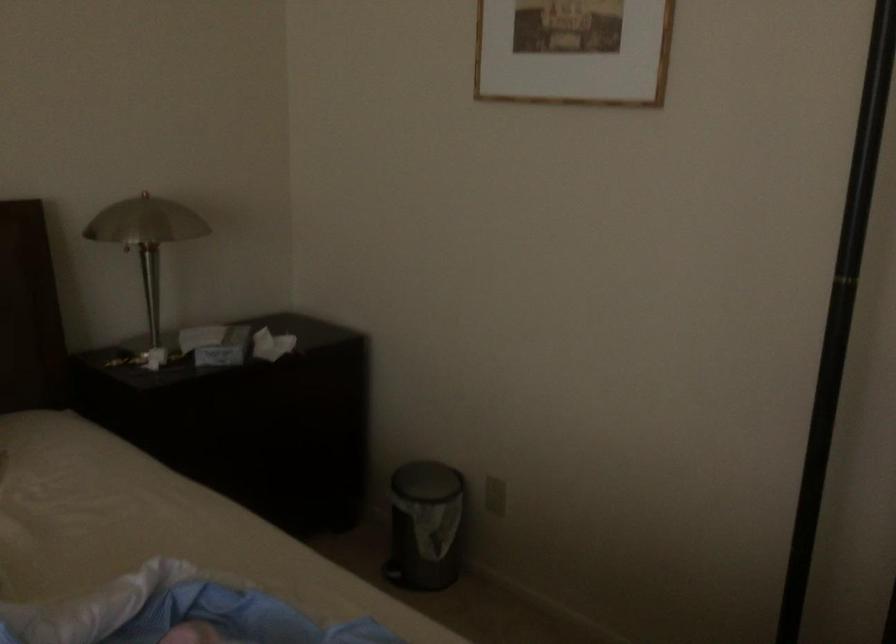
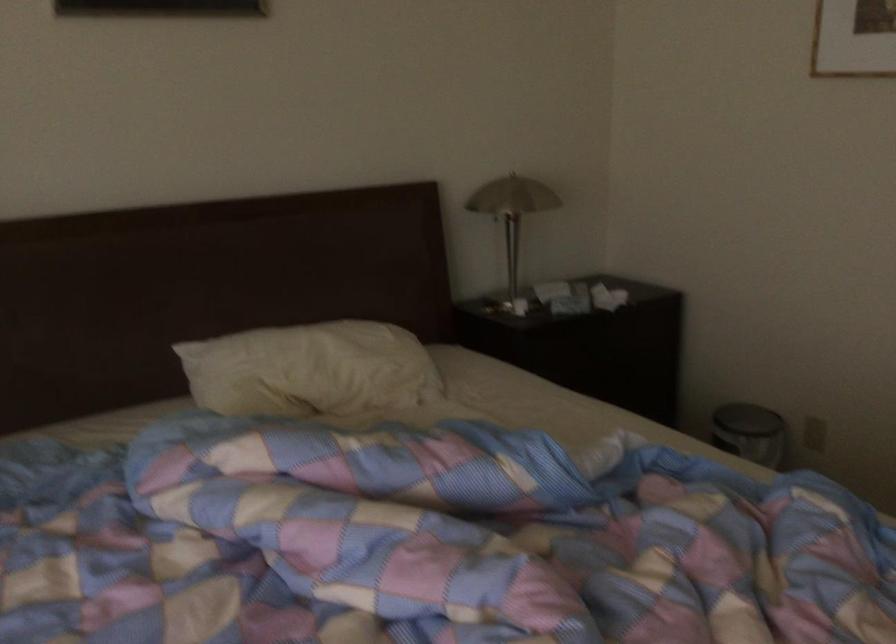
Question: I am providing you with two images of the same scene from different viewpoints. Please identify which objects are invisible in image2.

Choices:
 (A) white pillow
 (B) small trash can
 (C) white folded towel
 (D) trash can pedal

Answer: (D)